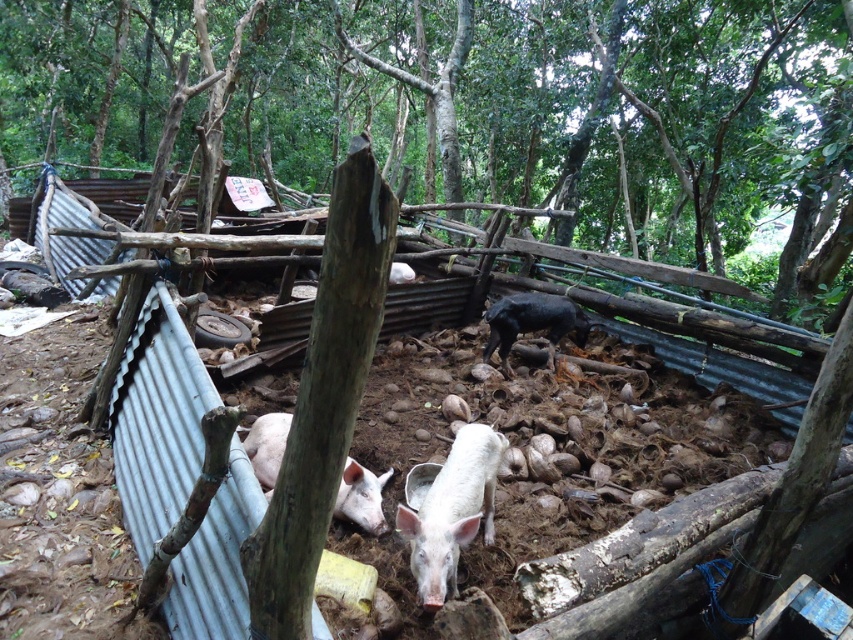
Is point (450, 461) positioned before point (556, 333)?

Yes, it is in front of point (556, 333).

Does white matte pig at center have a greater width compared to shiny black pig at center?

Incorrect, white matte pig at center's width does not surpass shiny black pig at center's.

Does point (486, 472) come closer to viewer compared to point (560, 314)?

That is True.

Find the location of a particular element. Image resolution: width=853 pixels, height=640 pixels. white matte pig at center is located at coordinates (451, 512).

Which is above, white matte mud at center or shiny black pig at center?

shiny black pig at center is above.

What do you see at coordinates (604, 435) in the screenshot?
I see `white matte mud at center` at bounding box center [604, 435].

The height and width of the screenshot is (640, 853). Find the location of `white matte mud at center`. white matte mud at center is located at coordinates (604, 435).

What do you see at coordinates (361, 497) in the screenshot? The height and width of the screenshot is (640, 853). I see `white matte pig at lower left` at bounding box center [361, 497].

Is white matte pig at lower left below shiny black pig at center?

Yes, white matte pig at lower left is below shiny black pig at center.

This screenshot has width=853, height=640. Describe the element at coordinates (361, 497) in the screenshot. I see `white matte pig at lower left` at that location.

I want to click on white matte pig at lower left, so click(x=361, y=497).